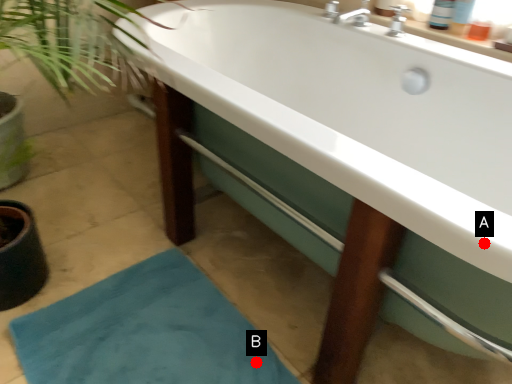
Question: Two points are circled on the image, labeled by A and B beside each circle. Which point is closer to the camera?

Choices:
 (A) A is closer
 (B) B is closer

Answer: (A)